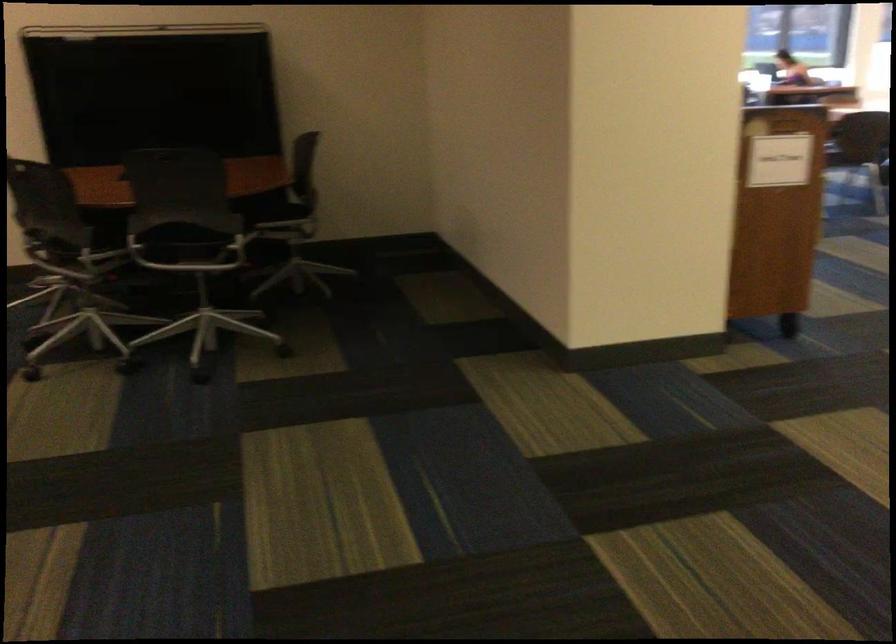
This screenshot has height=644, width=896. I want to click on metal chair armrest, so 256,237.